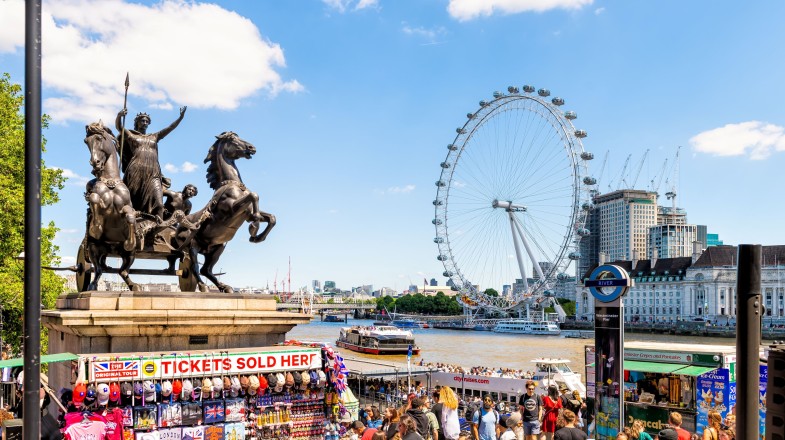
Identify the location of pedestal. The width and height of the screenshot is (785, 440). (141, 302).